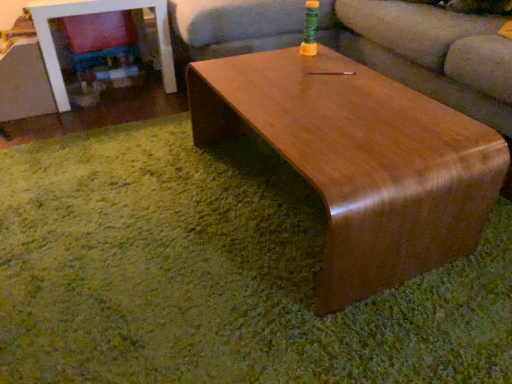
Question: From a real-world perspective, is matte brown couch at center below shiny brown wood coffee table at center?

Choices:
 (A) no
 (B) yes

Answer: (A)

Question: From the image's perspective, is matte brown couch at center located beneath shiny brown wood coffee table at center?

Choices:
 (A) no
 (B) yes

Answer: (A)

Question: Is shiny brown wood coffee table at center at the back of matte brown couch at center?

Choices:
 (A) yes
 (B) no

Answer: (B)

Question: Is matte brown couch at center thinner than shiny brown wood coffee table at center?

Choices:
 (A) no
 (B) yes

Answer: (A)

Question: Can you confirm if matte brown couch at center is taller than shiny brown wood coffee table at center?

Choices:
 (A) yes
 (B) no

Answer: (A)

Question: Based on their positions, is matte brown couch at center located to the left or right of shiny brown wood coffee table at center?

Choices:
 (A) left
 (B) right

Answer: (B)

Question: Is point (364, 23) positioned closer to the camera than point (395, 233)?

Choices:
 (A) closer
 (B) farther

Answer: (B)

Question: Considering the positions of matte brown couch at center and shiny brown wood coffee table at center in the image, is matte brown couch at center bigger or smaller than shiny brown wood coffee table at center?

Choices:
 (A) small
 (B) big

Answer: (B)

Question: In terms of width, does matte brown couch at center look wider or thinner when compared to shiny brown wood coffee table at center?

Choices:
 (A) wide
 (B) thin

Answer: (A)

Question: From the image's perspective, is shiny brown wood coffee table at center located above or below glossy wood table at center?

Choices:
 (A) below
 (B) above

Answer: (A)

Question: Is shiny brown wood coffee table at center bigger or smaller than glossy wood table at center?

Choices:
 (A) small
 (B) big

Answer: (B)

Question: Is shiny brown wood coffee table at center wider or thinner than glossy wood table at center?

Choices:
 (A) thin
 (B) wide

Answer: (A)

Question: Considering their positions, is shiny brown wood coffee table at center located in front of or behind glossy wood table at center?

Choices:
 (A) front
 (B) behind

Answer: (A)

Question: Is glossy wood table at center situated inside shiny brown wood coffee table at center or outside?

Choices:
 (A) inside
 (B) outside

Answer: (B)

Question: Would you say glossy wood table at center is to the left or to the right of shiny brown wood coffee table at center in the picture?

Choices:
 (A) left
 (B) right

Answer: (A)